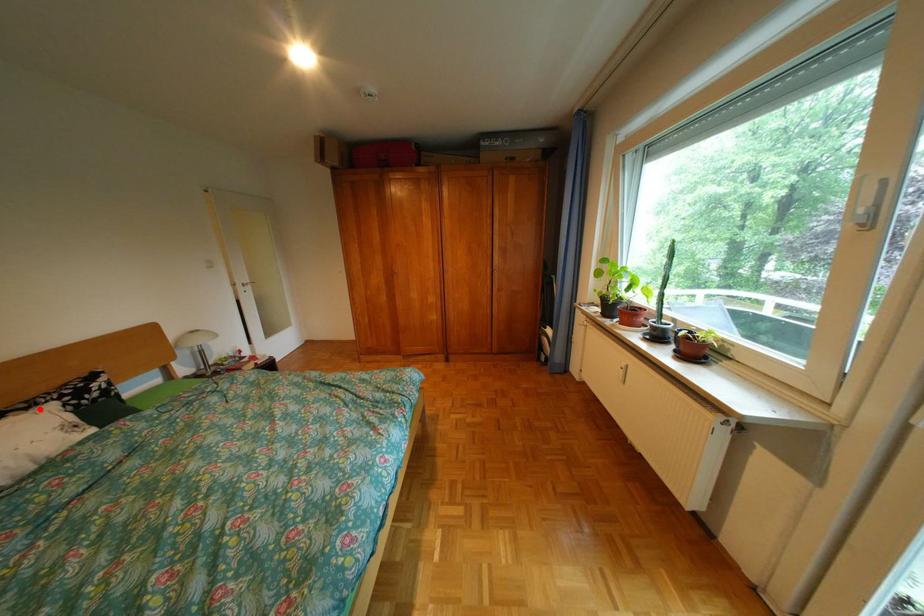
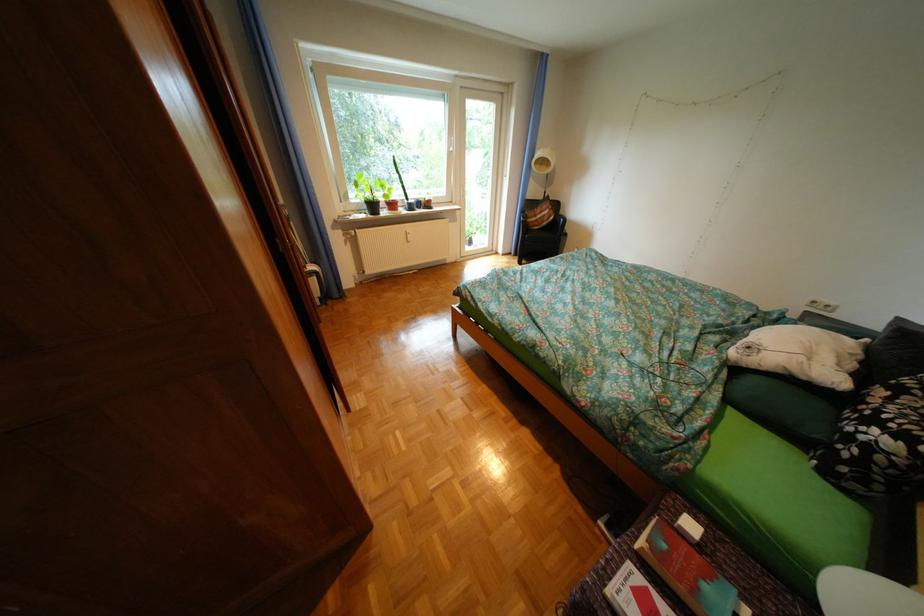
Where in the second image is the point corresponding to the highlighted location from the first image?

(904, 399)